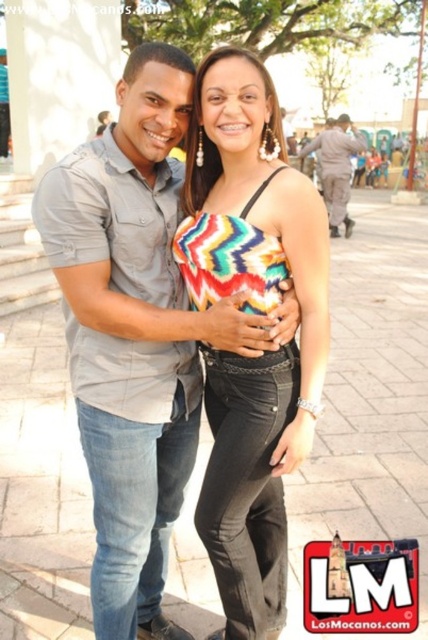
Question: Is the position of multicolored zigzag top at center less distant than that of camouflage fabric uniform at right?

Choices:
 (A) no
 (B) yes

Answer: (B)

Question: Observing the image, what is the correct spatial positioning of multicolored zigzag top at center in reference to camouflage fabric uniform at right?

Choices:
 (A) right
 (B) left

Answer: (B)

Question: Can you confirm if multicolored zigzag top at center is bigger than camouflage fabric uniform at right?

Choices:
 (A) yes
 (B) no

Answer: (A)

Question: Which object is closer to the camera taking this photo?

Choices:
 (A) camouflage fabric uniform at right
 (B) multicolored zigzag top at center

Answer: (B)

Question: Which of the following is the closest to the observer?

Choices:
 (A) camouflage fabric uniform at right
 (B) multicolored zigzag top at center

Answer: (B)